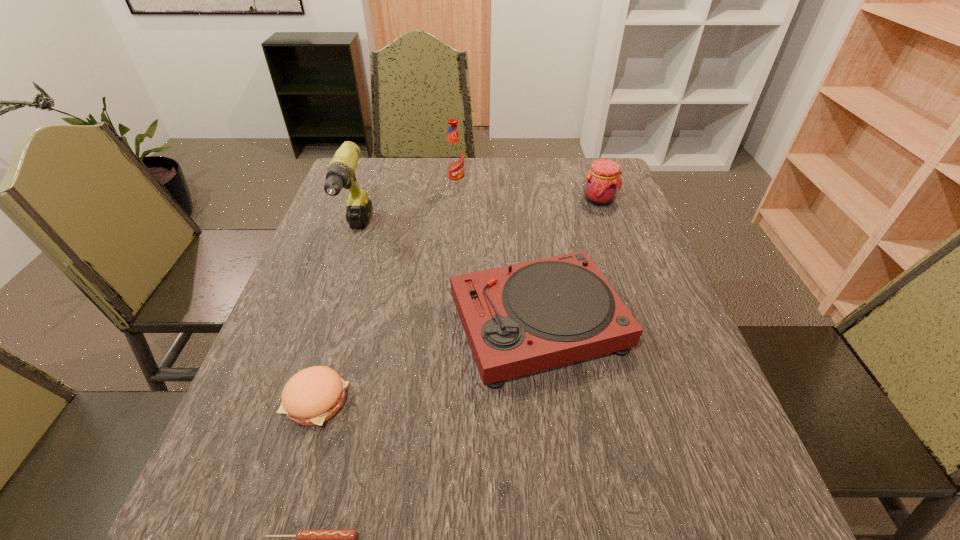
The height and width of the screenshot is (540, 960). What are the coordinates of `vacant space at the right edge of the desktop` in the screenshot? It's located at pyautogui.click(x=578, y=211).

The height and width of the screenshot is (540, 960). In order to click on free space at the far left corner in this screenshot , I will do `click(396, 161)`.

In the image, there is a desktop. Identify the location of vacant space at the near left corner. Image resolution: width=960 pixels, height=540 pixels. click(229, 512).

At what (x,y) coordinates should I click in order to perform the action: click on empty location between the record player and the second shortest object. Please return your answer as a coordinate pair (x, y). Looking at the image, I should click on (427, 362).

I want to click on vacant region between the root beer and the jam, so click(527, 194).

Identify the location of free space between the record player and the root beer. The image size is (960, 540). (496, 255).

This screenshot has width=960, height=540. Find the location of `free space between the jam and the root beer`. free space between the jam and the root beer is located at coordinates (527, 194).

Where is `vacant point located between the root beer and the record player`? vacant point located between the root beer and the record player is located at coordinates (496, 255).

Identify which object is the second nearest to the root beer. Please provide its 2D coordinates. Your answer should be formatted as a tuple, i.e. [(x, y)], where the tuple contains the x and y coordinates of a point satisfying the conditions above.

[(602, 181)]

This screenshot has width=960, height=540. What are the coordinates of `the fifth closest object to the jam` in the screenshot? It's located at (306, 539).